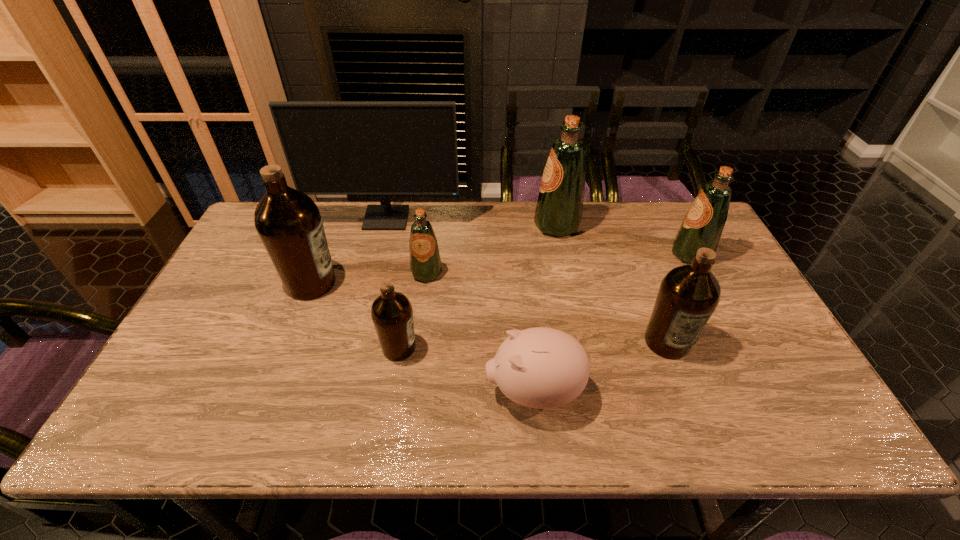
Find the location of `computer monitor`. computer monitor is located at coordinates (384, 148).

Find the location of a particular element. the biggest green olive oil is located at coordinates (559, 209).

I want to click on the farthest olive oil, so click(x=559, y=209).

Identify the location of the farthest brown olive oil. (288, 222).

Find the location of a particular element. The image size is (960, 540). the leftmost olive oil is located at coordinates (288, 222).

Image resolution: width=960 pixels, height=540 pixels. In order to click on the rightmost green olive oil in this screenshot , I will do `click(702, 227)`.

Identify the location of the rightmost object. (702, 227).

In order to click on the rightmost brown olive oil in this screenshot , I will do `click(688, 295)`.

Where is `the second smallest brown olive oil`? The image size is (960, 540). the second smallest brown olive oil is located at coordinates (688, 295).

You are a GUI agent. You are given a task and a screenshot of the screen. Output one action in this format:
    pyautogui.click(x=<x>, y=<y>)
    Task: Click on the smallest green olive oil
    The width and height of the screenshot is (960, 540).
    Given the screenshot: What is the action you would take?
    pyautogui.click(x=425, y=264)